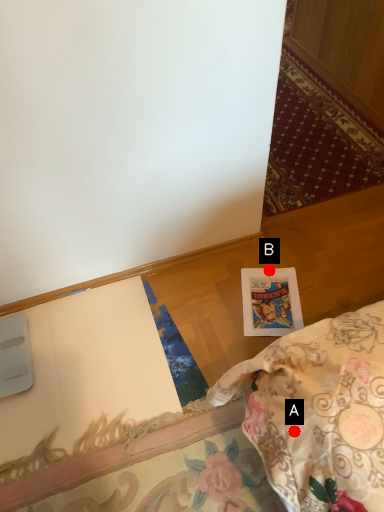
Question: Two points are circled on the image, labeled by A and B beside each circle. Among these points, which one is nearest to the camera?

Choices:
 (A) A is closer
 (B) B is closer

Answer: (A)